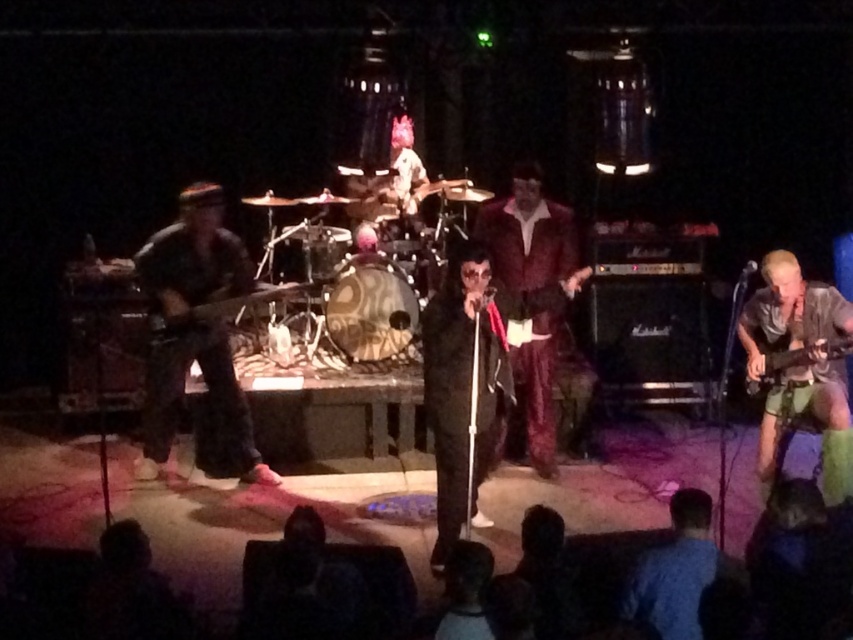
Question: Is camouflage fabric guitar at left above wooden electric guitar at center?

Choices:
 (A) no
 (B) yes

Answer: (A)

Question: Which of the following is the farthest from the observer?

Choices:
 (A) click(x=643, y=595)
 (B) click(x=190, y=312)

Answer: (B)

Question: Which of these objects is positioned closest to the blue fabric shirt at lower center?

Choices:
 (A) wooden electric guitar at center
 (B) camouflage fabric guitar at left
 (C) denim shorts at right
 (D) metallic silver guitar at right

Answer: (C)

Question: Does blue fabric shirt at lower center have a smaller size compared to wooden electric guitar at center?

Choices:
 (A) no
 (B) yes

Answer: (B)

Question: Among these objects, which one is nearest to the camera?

Choices:
 (A) blue fabric shirt at lower center
 (B) wooden electric guitar at center

Answer: (A)

Question: From the image, what is the correct spatial relationship of camouflage fabric guitar at left in relation to metallic silver guitar at right?

Choices:
 (A) above
 (B) below

Answer: (A)